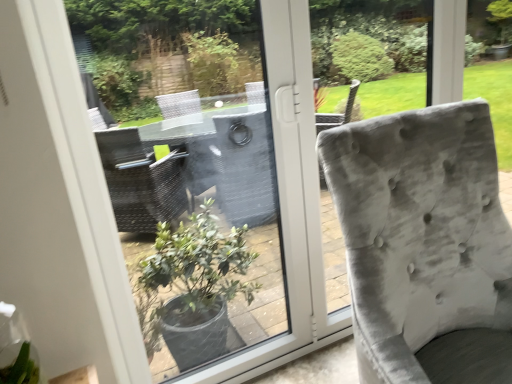
This screenshot has height=384, width=512. What do you see at coordinates (419, 232) in the screenshot? I see `velvet grey chair at right` at bounding box center [419, 232].

Where is `velvet grey chair at right`? The image size is (512, 384). velvet grey chair at right is located at coordinates (419, 232).

Image resolution: width=512 pixels, height=384 pixels. Identify the location of velvet grey chair at right. (419, 232).